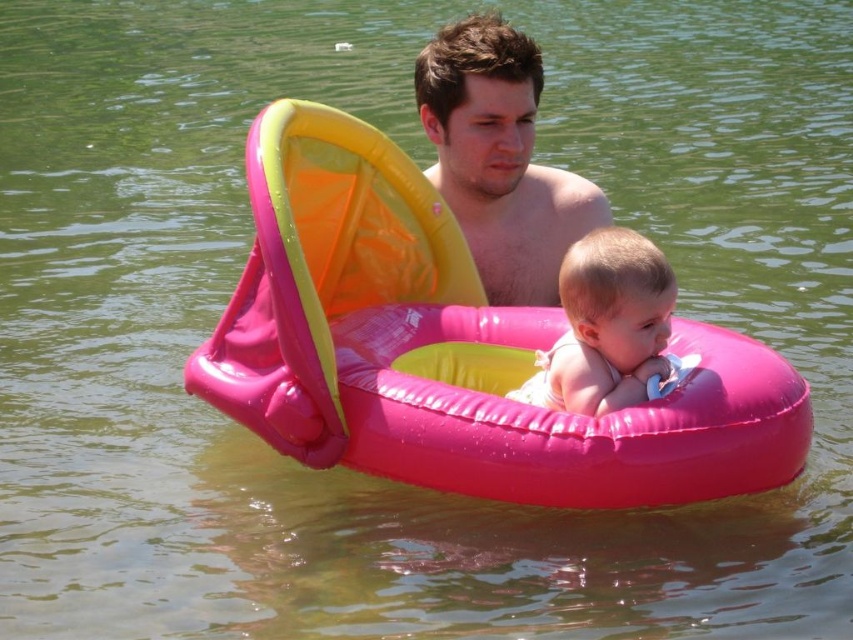
Between pink rubber baby float at center and shiny skin at center, which one appears on the left side from the viewer's perspective?

From the viewer's perspective, shiny skin at center appears more on the left side.

Is point (582, 397) closer to viewer compared to point (488, 234)?

Yes.

At what (x,y) coordinates should I click in order to perform the action: click on pink rubber baby float at center. Please return your answer as a coordinate pair (x, y). This screenshot has height=640, width=853. Looking at the image, I should click on (606, 324).

Which is more to the right, shiny brown hair at upper center or pink rubber baby float at center?

pink rubber baby float at center is more to the right.

Is shiny brown hair at upper center closer to camera compared to pink rubber baby float at center?

No, it is behind pink rubber baby float at center.

Which is behind, point (488, 220) or point (590, 376)?

Positioned behind is point (488, 220).

In order to click on shiny brown hair at upper center in this screenshot , I will do `click(498, 157)`.

Can you confirm if shiny brown hair at upper center is shorter than shiny skin at center?

No, shiny brown hair at upper center is not shorter than shiny skin at center.

What do you see at coordinates (498, 157) in the screenshot? I see `shiny brown hair at upper center` at bounding box center [498, 157].

The height and width of the screenshot is (640, 853). What are the coordinates of `shiny brown hair at upper center` in the screenshot? It's located at (498, 157).